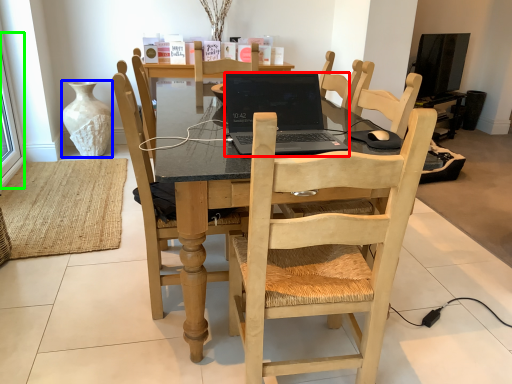
Question: Which object is positioned farthest from laptop (highlighted by a red box)? Select from vase (highlighted by a blue box) and window screen (highlighted by a green box).

Choices:
 (A) vase
 (B) window screen

Answer: (A)